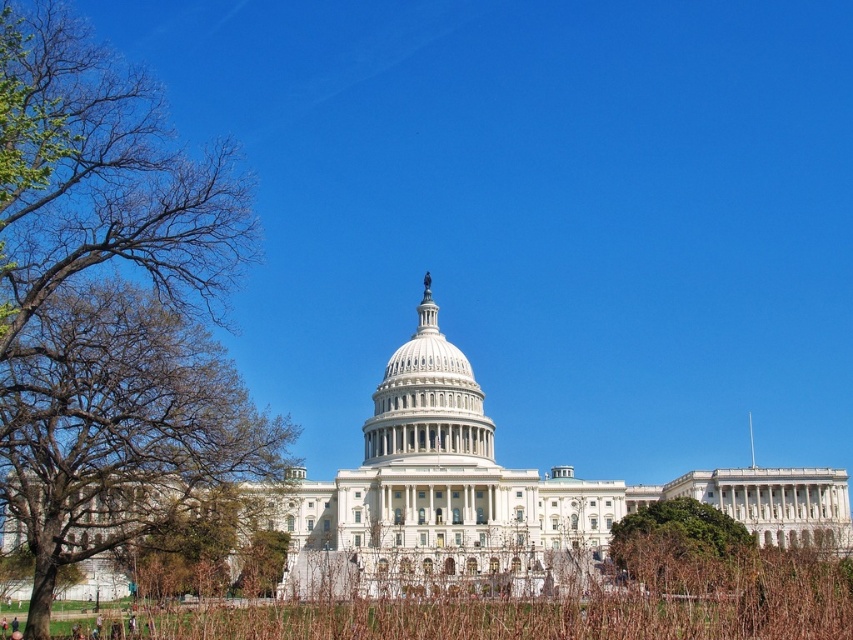
You are standing in front of the United States Capitol building and notice two points marked on the ground. One is at coordinates point (91, 330) and the other at point (462, 436). Which point is closer to you?

Point (91, 330) is in front of point (462, 436), so it is closer to you.

You are standing in front of the United States Capitol building and notice the white marble dome at center and the green leafy tree at lower right. Which object is located to the left of the other?

The white marble dome at center is positioned on the left side of green leafy tree at lower right.

You are a photographer planning to take a photo of the United States Capitol building. You want to ensure that both the brown leafy tree at left and the green leafy tree at lower right are visible in the frame. Given their distance apart, can you estimate if a standard 50mm lens on a full frame camera would capture both trees in the same shot?

The brown leafy tree at left is 143.94 feet from the green leafy tree at lower right. A standard 50mm lens on a full frame camera has an angle of view of approximately 46 degrees horizontally. At typical shooting distances for such a landmark, 143.94 feet between the trees might exceed the lens field of view unless you position yourself far enough back. However without knowing exact camera position distance from the trees, it requires further calculation.